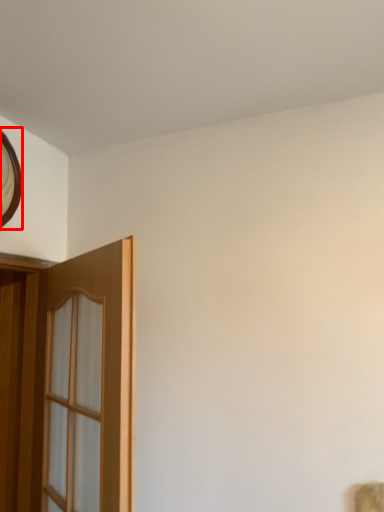
Question: From the image's perspective, where is clock (annotated by the red box) located relative to door?

Choices:
 (A) below
 (B) above

Answer: (B)